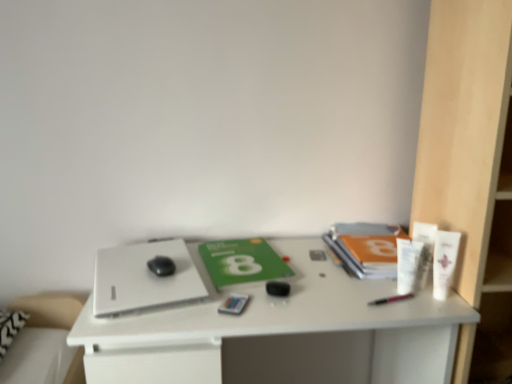
This screenshot has width=512, height=384. I want to click on free space to the left of orange matte book at right, the first paperback book when ordered from right to left, so click(x=306, y=260).